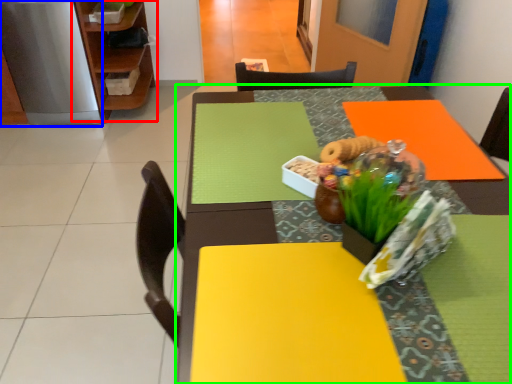
Question: Based on their relative distances, which object is farther from shelf (highlighted by a red box)? Choose from appliance (highlighted by a blue box) and table (highlighted by a green box).

Choices:
 (A) appliance
 (B) table

Answer: (B)